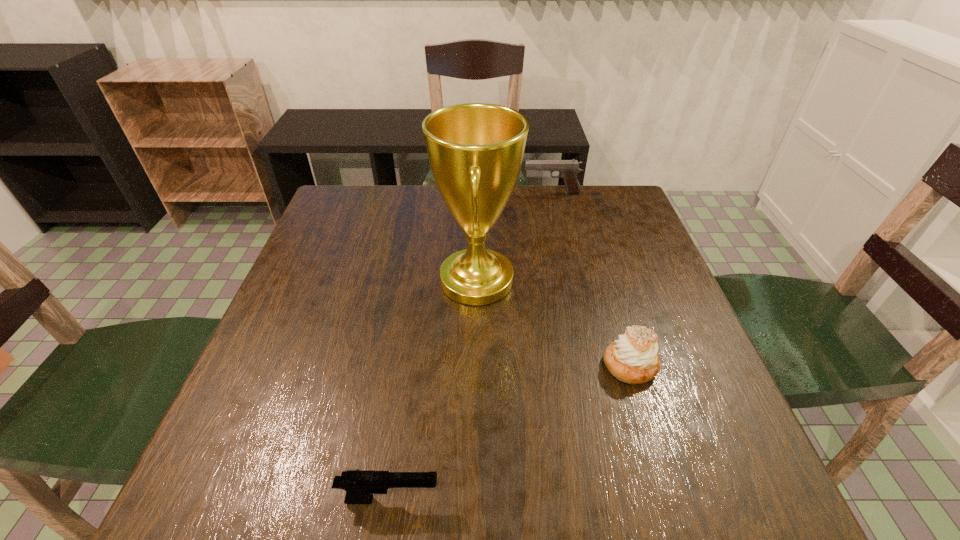
I want to click on unoccupied area between the farthest object and the tallest object, so click(x=515, y=237).

Find the location of a particular element. Image resolution: width=960 pixels, height=540 pixels. free spot between the tallest object and the farther pistol is located at coordinates (515, 237).

Point out which object is positioned as the third nearest to the nearer pistol. Please provide its 2D coordinates. Your answer should be formatted as a tuple, i.e. [(x, y)], where the tuple contains the x and y coordinates of a point satisfying the conditions above.

[(568, 169)]

Identify which object is the third closest to the nearest object. Please provide its 2D coordinates. Your answer should be formatted as a tuple, i.e. [(x, y)], where the tuple contains the x and y coordinates of a point satisfying the conditions above.

[(568, 169)]

Where is `free space in the image that satisfies the following two spatial constraints: 1. on the front side of the second nearest object; 2. on the front-facing side of the nearer pistol`? This screenshot has width=960, height=540. free space in the image that satisfies the following two spatial constraints: 1. on the front side of the second nearest object; 2. on the front-facing side of the nearer pistol is located at coordinates (671, 500).

Find the location of a particular element. vacant point that satisfies the following two spatial constraints: 1. by the handles of the third farthest object; 2. on the right side of the second farthest object is located at coordinates (476, 365).

Where is `free point that satisfies the following two spatial constraints: 1. on the front side of the third farthest object; 2. on the front-facing side of the nearer pistol`? free point that satisfies the following two spatial constraints: 1. on the front side of the third farthest object; 2. on the front-facing side of the nearer pistol is located at coordinates (671, 500).

Identify the location of free location that satisfies the following two spatial constraints: 1. by the handles of the award; 2. on the left side of the pastry. (476, 365).